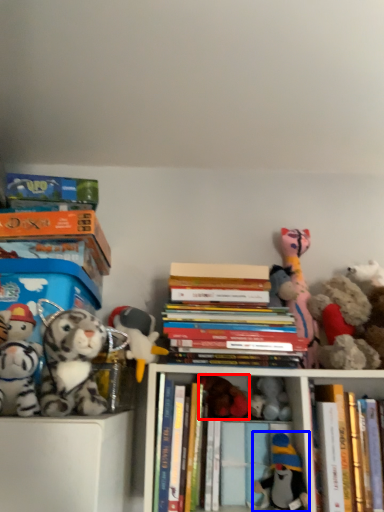
Question: Which point is closer to the camera, toy (highlighted by a red box) or toy (highlighted by a blue box)?

Choices:
 (A) toy
 (B) toy

Answer: (B)